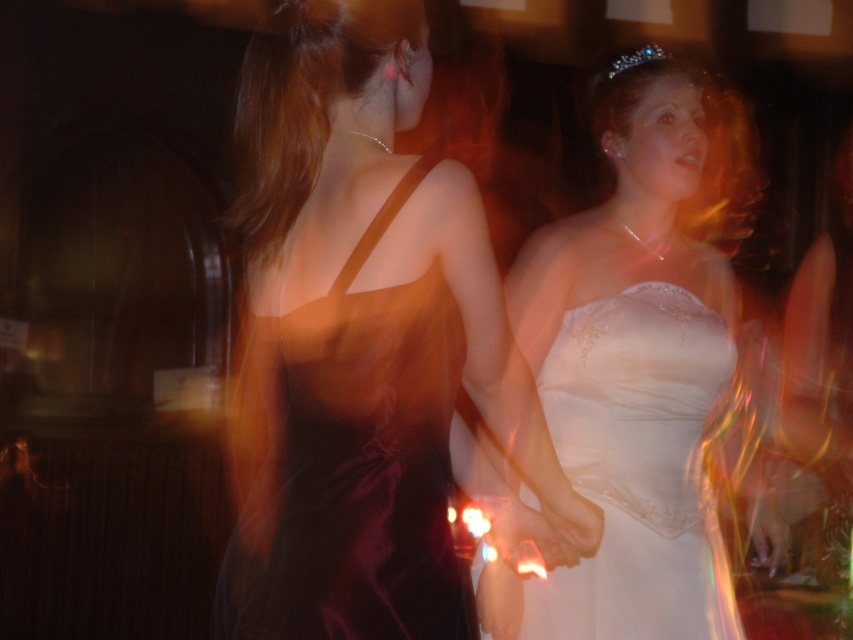
Can you confirm if satin burgundy dress at center is wider than white satin dress at center?

Indeed, satin burgundy dress at center has a greater width compared to white satin dress at center.

Is satin burgundy dress at center bigger than white satin dress at center?

Correct, satin burgundy dress at center is larger in size than white satin dress at center.

At what (x,y) coordinates should I click in order to perform the action: click on satin burgundy dress at center. Please return your answer as a coordinate pair (x, y). This screenshot has height=640, width=853. Looking at the image, I should click on 366,348.

Who is lower down, satin burgundy dress at center or clear crystal tiara at upper right?

satin burgundy dress at center

Who is more forward, (367, 42) or (624, 54)?

Point (367, 42)

Which is in front, point (271, 42) or point (648, 54)?

Positioned in front is point (271, 42).

I want to click on satin burgundy dress at center, so click(366, 348).

Which is behind, point (693, 120) or point (614, 72)?

Positioned behind is point (693, 120).

Is white satin dress at center positioned before clear crystal tiara at upper right?

Yes, white satin dress at center is closer to the viewer.

You are a GUI agent. You are given a task and a screenshot of the screen. Output one action in this format:
    pyautogui.click(x=<x>, y=<y>)
    Task: Click on the white satin dress at center
    
    Given the screenshot: What is the action you would take?
    pyautogui.click(x=636, y=364)